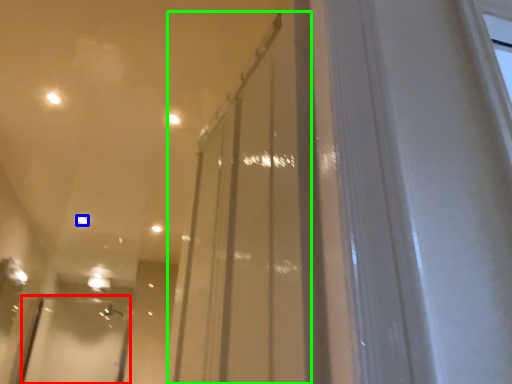
Question: Which object is the closest to the screen door (highlighted by a red box)? Choose among these: light (highlighted by a blue box) or glass door (highlighted by a green box).

Choices:
 (A) light
 (B) glass door

Answer: (A)